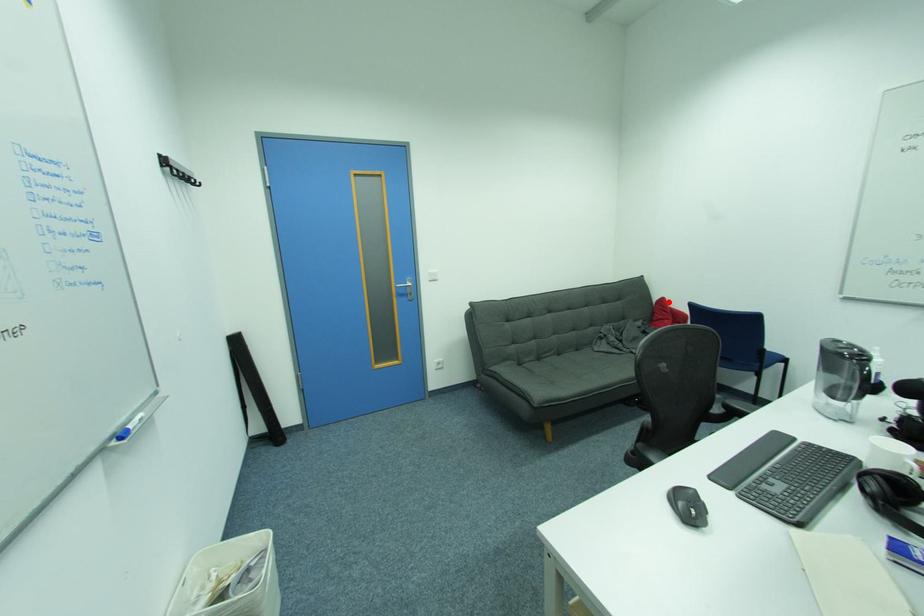
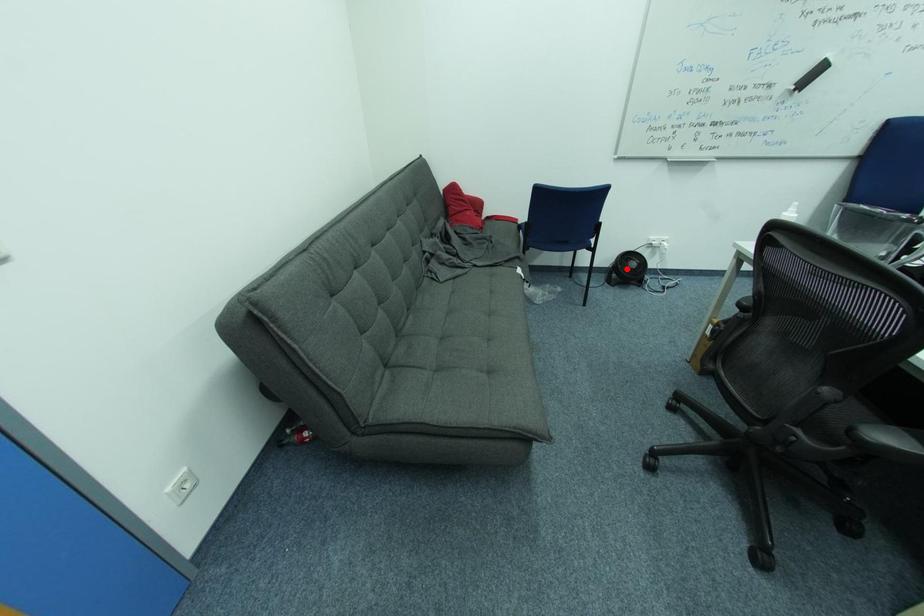
I am providing you with two images of the same scene from different viewpoints. A red point is marked on the first image and another point is marked on the second image. Does the point marked in image1 correspond to the same location as the one in image2?

No